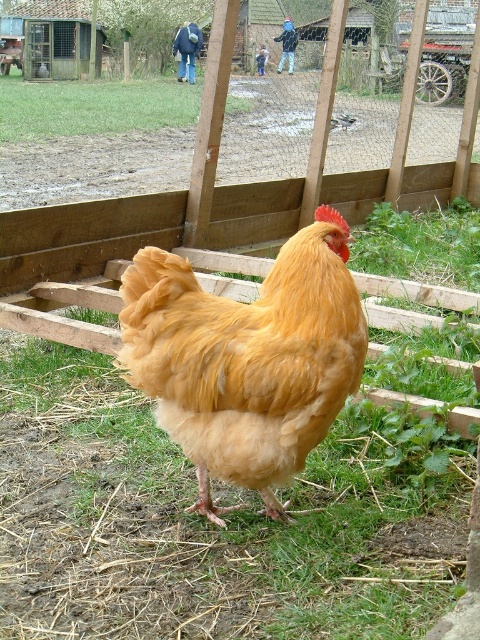
Which of these two, golden feathered rooster at center or green grass at center, stands shorter?

golden feathered rooster at center is shorter.

In the scene shown: Between golden feathered rooster at center and green grass at center, which one is positioned higher?

green grass at center

Is point (267, 378) positioned before point (153, 106)?

Yes, it is in front of point (153, 106).

The height and width of the screenshot is (640, 480). In order to click on golden feathered rooster at center in this screenshot , I will do `click(247, 358)`.